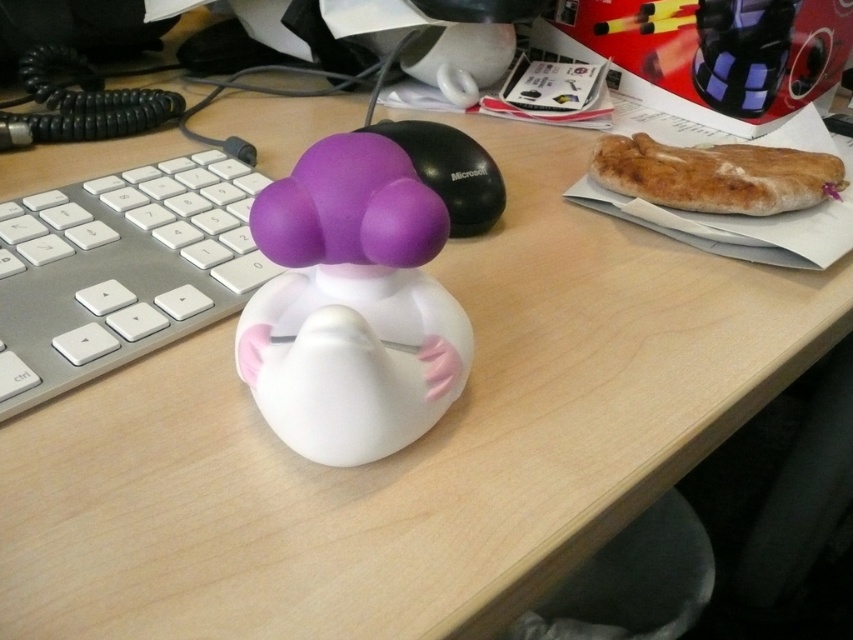
Question: Which of these objects is positioned farthest from the silver metallic keyboard at center-left?

Choices:
 (A) matte rubber duck at center
 (B) bread crusty at right
 (C) black matte mouse at center

Answer: (B)

Question: Is bread crusty at right thinner than black matte mouse at center?

Choices:
 (A) yes
 (B) no

Answer: (B)

Question: Can you confirm if matte rubber duck at center is thinner than black matte mouse at center?

Choices:
 (A) no
 (B) yes

Answer: (B)

Question: Which point is closer to the camera?

Choices:
 (A) (502, 204)
 (B) (283, 378)
 (C) (599, 170)
 (D) (165, 230)

Answer: (B)

Question: Which of the following is the closest to the observer?

Choices:
 (A) bread crusty at right
 (B) silver metallic keyboard at center-left
 (C) black matte mouse at center
 (D) matte rubber duck at center

Answer: (D)

Question: Is matte rubber duck at center smaller than silver metallic keyboard at center-left?

Choices:
 (A) yes
 (B) no

Answer: (A)